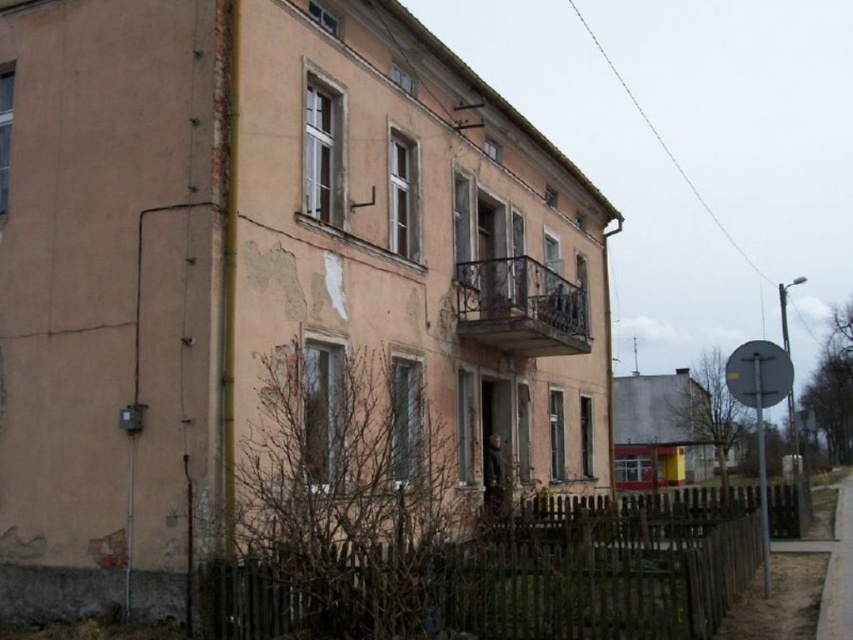
Is brown wooden fence at lower center to the left of rusty metal balcony at center from the viewer's perspective?

No, brown wooden fence at lower center is not to the left of rusty metal balcony at center.

Does point (314, 586) lie in front of point (509, 352)?

That is True.

Where is `brown wooden fence at lower center`? The height and width of the screenshot is (640, 853). brown wooden fence at lower center is located at coordinates (509, 577).

Where is `brown wooden fence at lower center`? brown wooden fence at lower center is located at coordinates (509, 577).

Is brown wooden fence at lower center thinner than silver metallic sign at right?

Yes.

Which is in front, point (280, 550) or point (764, 486)?

Positioned in front is point (280, 550).

The width and height of the screenshot is (853, 640). Identify the location of brown wooden fence at lower center. (509, 577).

Find the location of a particular element. This screenshot has width=853, height=640. rusty metal balcony at center is located at coordinates (520, 307).

Can you confirm if rusty metal balcony at center is taller than silver metallic sign at right?

In fact, rusty metal balcony at center may be shorter than silver metallic sign at right.

Is point (583, 307) in front of point (764, 541)?

No, it is behind (764, 541).

The height and width of the screenshot is (640, 853). What are the coordinates of `rusty metal balcony at center` in the screenshot? It's located at (520, 307).